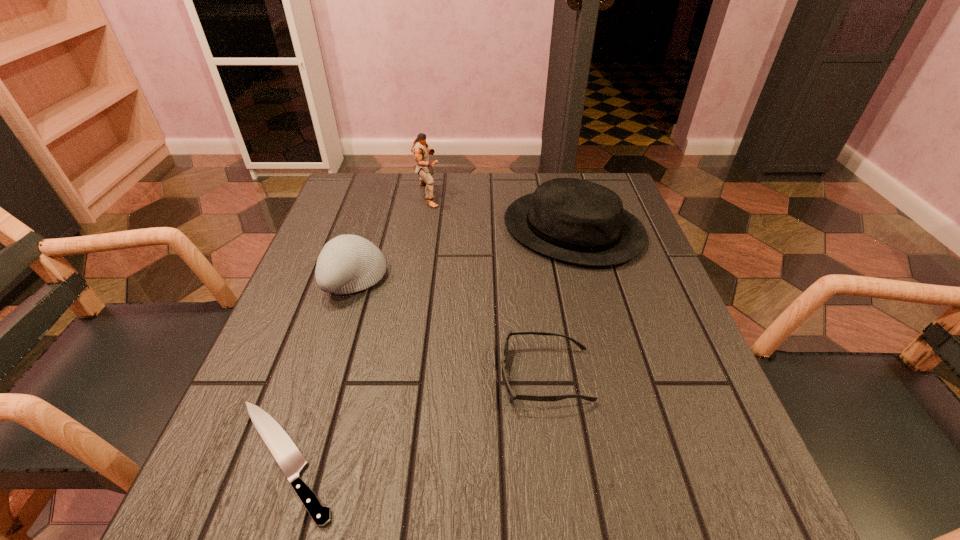
At what (x,y) coordinates should I click in order to perform the action: click on object located at the far right corner. Please return your answer as a coordinate pair (x, y). Looking at the image, I should click on (573, 220).

The image size is (960, 540). Find the location of `free space at the far edge of the desktop`. free space at the far edge of the desktop is located at coordinates (412, 179).

The height and width of the screenshot is (540, 960). I want to click on vacant space at the near edge of the desktop, so click(x=568, y=516).

I want to click on blank space at the left edge of the desktop, so click(378, 239).

Find the location of a particular element. The height and width of the screenshot is (540, 960). vacant space at the far left corner of the desktop is located at coordinates (353, 211).

Find the location of `vacant space at the near left corner of the desktop`. vacant space at the near left corner of the desktop is located at coordinates (230, 509).

At what (x,y) coordinates should I click in order to perform the action: click on vacant area that lies between the beanie and the third object from left to right. Please return your answer as a coordinate pair (x, y). Image resolution: width=960 pixels, height=540 pixels. Looking at the image, I should click on (392, 237).

Identify the location of unoccupied area between the beanie and the tallest object. (392, 237).

The width and height of the screenshot is (960, 540). In order to click on vacant region between the fedora and the beanie in this screenshot , I will do `click(464, 254)`.

At what (x,y) coordinates should I click in order to perform the action: click on vacant area between the sunglasses and the fedora. Please return your answer as a coordinate pair (x, y). The image size is (960, 540). Looking at the image, I should click on (560, 302).